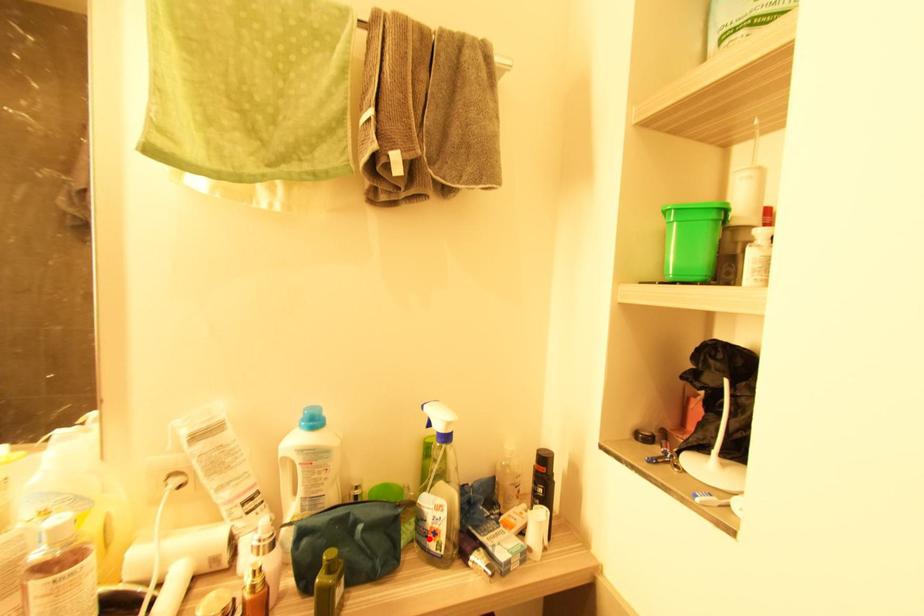
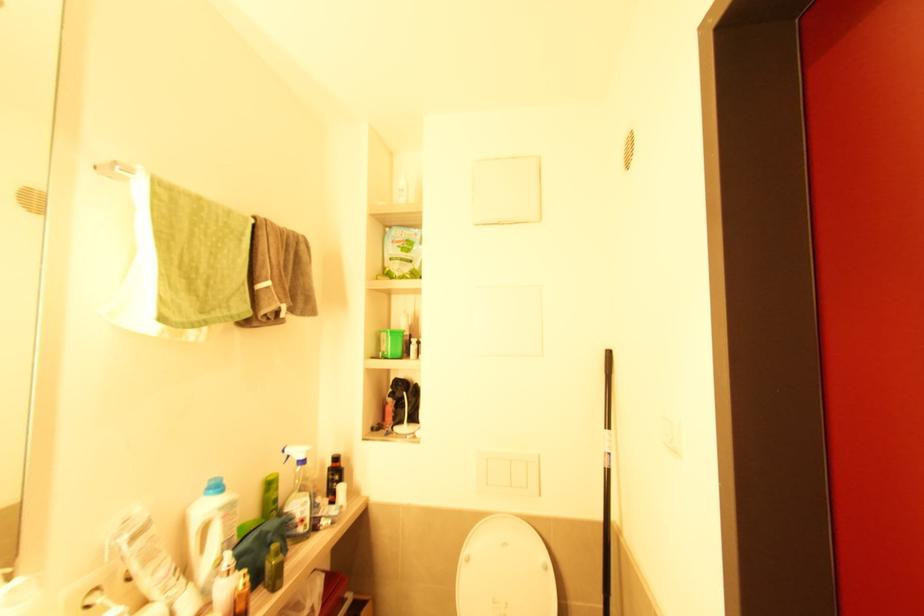
Find the pixel in the second image that matches the highlighted location in the first image.

(298, 527)